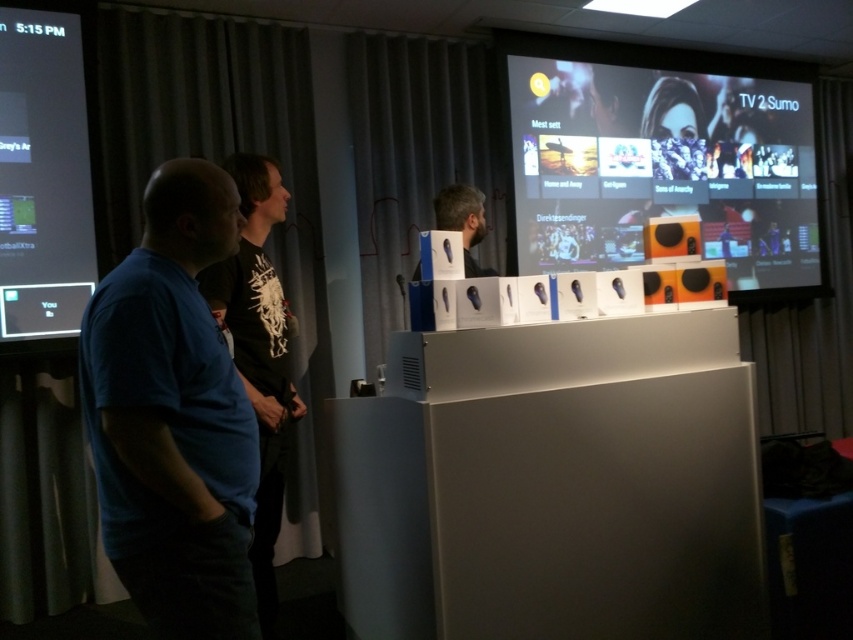
Is black t-shirt at left further to the viewer compared to matte black headphones at center?

Yes, black t-shirt at left is behind matte black headphones at center.

Is black t-shirt at left wider than matte black headphones at center?

No.

Does point (241, 285) lie behind point (473, 230)?

No, (241, 285) is closer to viewer.

Image resolution: width=853 pixels, height=640 pixels. Find the location of `black t-shirt at left`. black t-shirt at left is located at coordinates (259, 353).

Is matte black screen at upper right closer to camera compared to matte black screen at left?

That is False.

Does matte black screen at upper right appear over matte black screen at left?

Yes, matte black screen at upper right is above matte black screen at left.

Image resolution: width=853 pixels, height=640 pixels. I want to click on matte black screen at upper right, so click(664, 160).

I want to click on matte black screen at upper right, so click(664, 160).

Does blue cotton shirt at left have a greater width compared to matte black headphones at center?

Correct, the width of blue cotton shirt at left exceeds that of matte black headphones at center.

Can you confirm if blue cotton shirt at left is bigger than matte black headphones at center?

No, blue cotton shirt at left is not bigger than matte black headphones at center.

This screenshot has width=853, height=640. What do you see at coordinates (173, 417) in the screenshot? I see `blue cotton shirt at left` at bounding box center [173, 417].

Find the location of a particular element. The image size is (853, 640). blue cotton shirt at left is located at coordinates (173, 417).